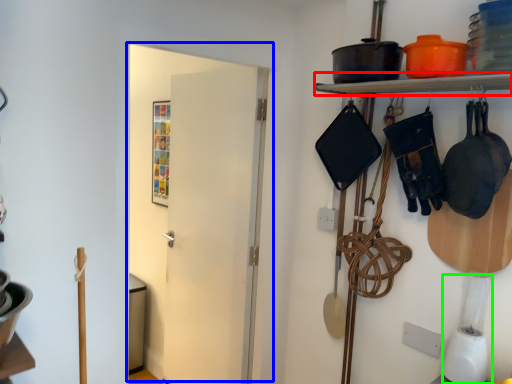
Question: Which is farther away from shelf (highlighted by a red box)? door (highlighted by a blue box) or appliance (highlighted by a green box)?

Choices:
 (A) door
 (B) appliance

Answer: (A)